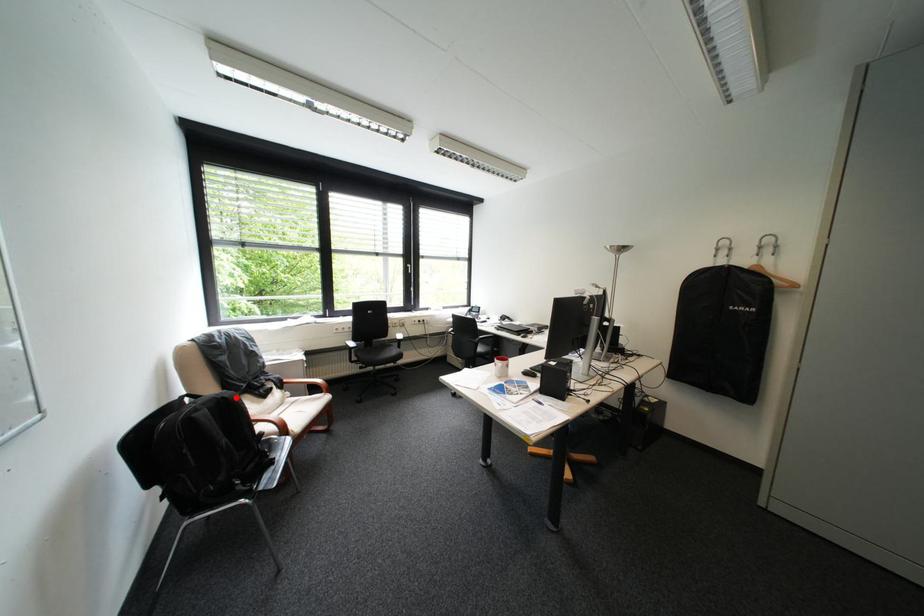
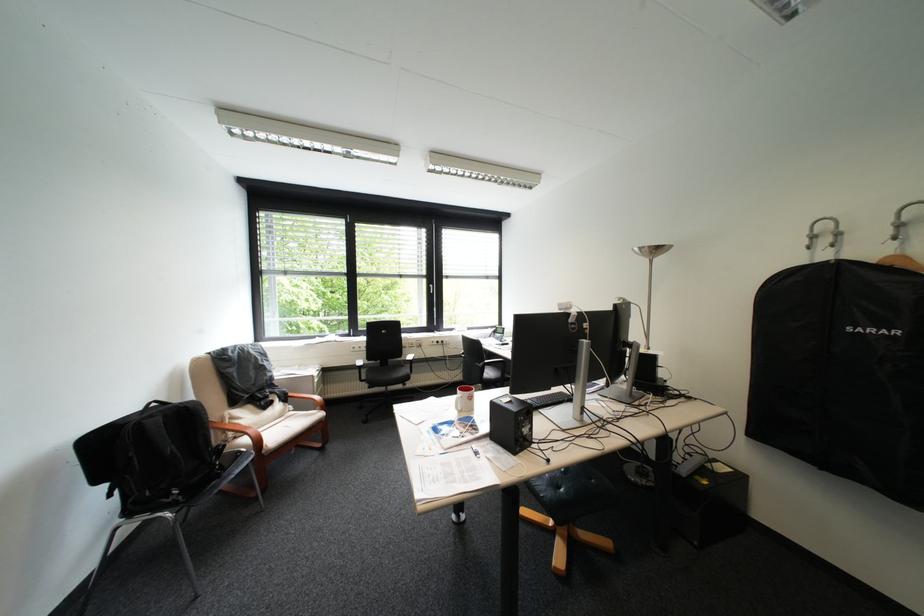
Question: I am providing you with two images of the same scene from different viewpoints. A red point is shown in image1. For the corresponding object point in image2, is it positioned nearer or farther from the camera?

Choices:
 (A) Nearer
 (B) Farther

Answer: (B)